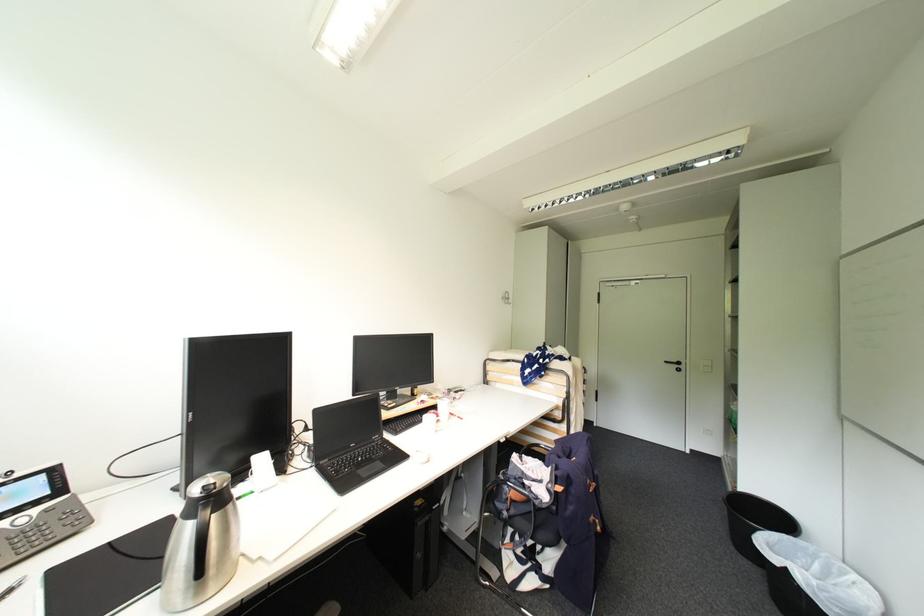
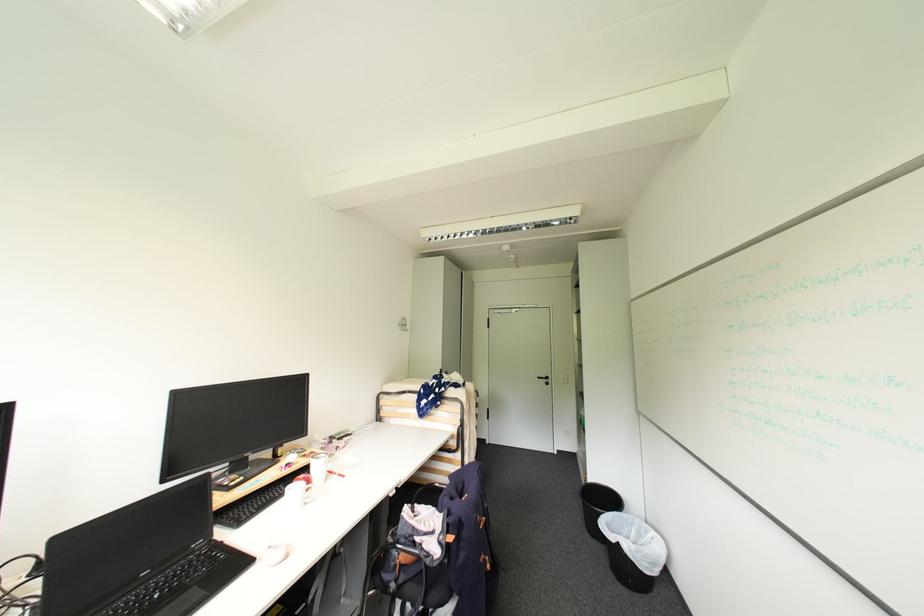
The point at [795,538] is marked in the first image. Where is the corresponding point in the second image?

(624, 514)